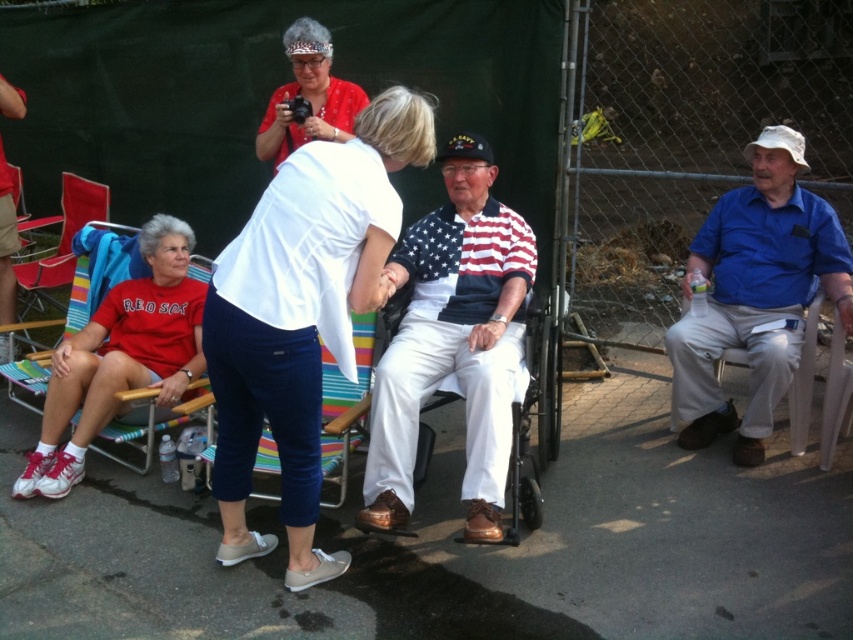
Question: Observing the image, what is the correct spatial positioning of american flag polo shirt at center in reference to white matte/red sox t-shirt at lower left?

Choices:
 (A) below
 (B) above

Answer: (B)

Question: Considering the real-world distances, which object is farthest from the matte red shirt at upper center?

Choices:
 (A) red cotton shirt at left
 (B) white cotton shirt at center
 (C) blue cotton shirt at right

Answer: (C)

Question: Is matte red shirt at upper center to the right of blue corduroy beach chair at center from the viewer's perspective?

Choices:
 (A) yes
 (B) no

Answer: (B)

Question: Which point is closer to the camera taking this photo?

Choices:
 (A) click(123, 321)
 (B) click(4, 292)

Answer: (A)

Question: Which of the following is the closest to the observer?

Choices:
 (A) (467, 490)
 (B) (367, 99)

Answer: (A)

Question: Is blue cotton shirt at right bigger than matte red shirt at upper center?

Choices:
 (A) yes
 (B) no

Answer: (A)